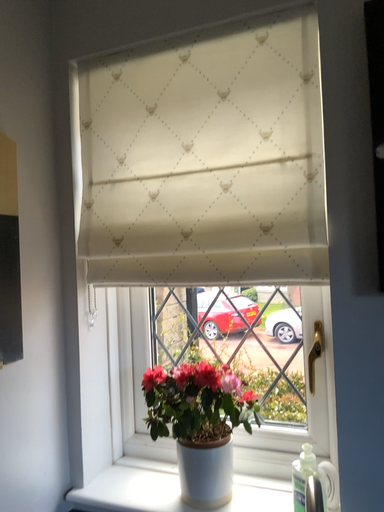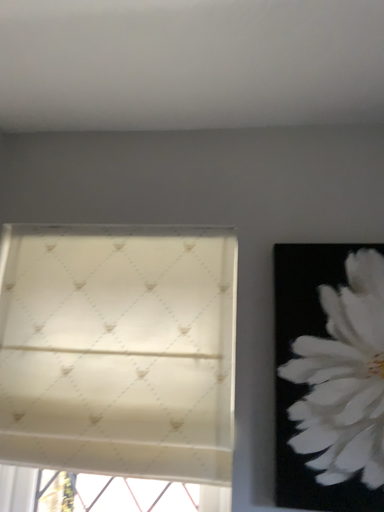
Question: Which way did the camera rotate in the video?

Choices:
 (A) rotated downward
 (B) rotated upward

Answer: (B)